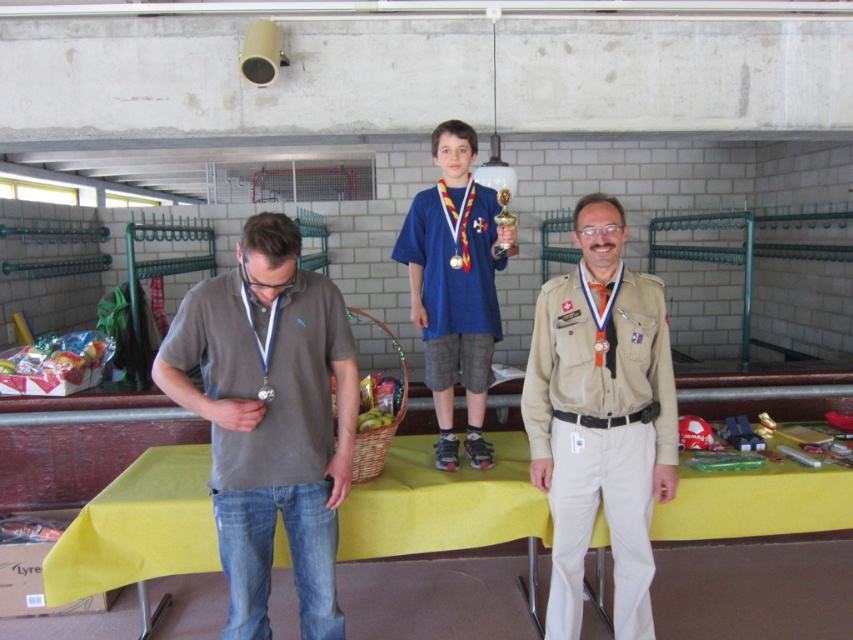
Is point (296, 241) behind point (409, 486)?

That is False.

Locate an element on the screen. This screenshot has width=853, height=640. matte gray shirt at center is located at coordinates (270, 419).

Measure the distance between matte gray shirt at center and camera.

The distance of matte gray shirt at center from camera is 7.13 feet.

Identify the location of matte gray shirt at center. Image resolution: width=853 pixels, height=640 pixels. pos(270,419).

Which is below, yellow fabric table at center or tan uniform at center?

yellow fabric table at center is below.

Is yellow fabric table at center positioned before tan uniform at center?

No, yellow fabric table at center is further to the viewer.

Is point (352, 547) closer to viewer compared to point (611, 314)?

That is False.

Find the location of a particular element. This screenshot has width=853, height=640. yellow fabric table at center is located at coordinates (442, 504).

Does tan uniform at center lie behind metallic gold medal at center?

Yes, tan uniform at center is behind metallic gold medal at center.

Between point (607, 321) and point (262, 384), which one is positioned in front?

Positioned in front is point (262, 384).

Is point (550, 349) less distant than point (271, 387)?

No, it is behind (271, 387).

Locate an element on the screen. The height and width of the screenshot is (640, 853). tan uniform at center is located at coordinates (601, 419).